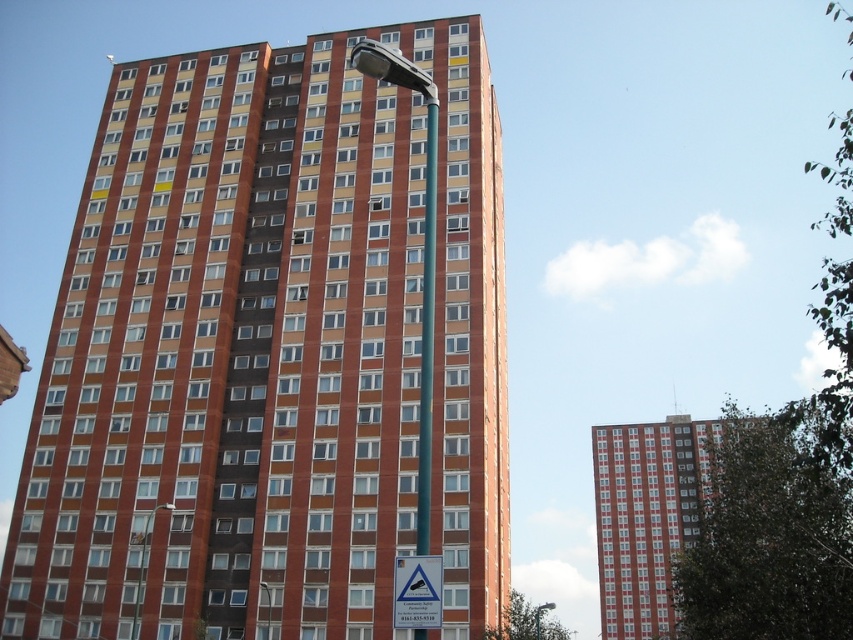
You are standing in front of the residential highrise and notice the green metallic pole at center. Based on its position, can you determine if it is closer to the building or the street?

The green metallic pole at center is located at point coordinates that are nearly the midpoint between the building and the street, so it is equidistant from both. However, since the pole is typically placed on the street side, it might be closer to the street than the building.

You are a city planner assessing the street layout. You need to install a new traffic light that must be placed exactly halfway between the brick building at center and the white plastic triangle at lower center. Given their relative sizes, which object will the traffic light be closer to?

The traffic light will be closer to the white plastic triangle at lower center because the brick building at center is wider than the white plastic triangle at lower center. Since the traffic light is placed halfway between them, the larger width of the building means the midpoint is nearer to the smaller triangle.

You are standing in front of the residential building and notice two points marked on the facade. The first point is at coordinates point (482, 35) and the second is at point (413, 621). Which point is closer to your eyes?

Point (482, 35) is further to the camera than point (413, 621), so the point closer to your eyes is point (413, 621).